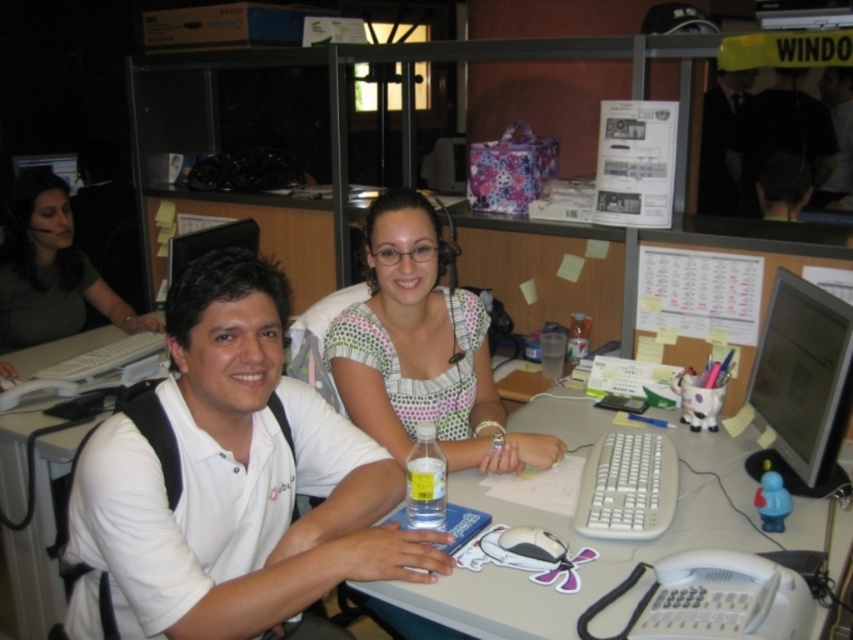
Question: Among these objects, which one is farthest from the camera?

Choices:
 (A) matte green shirt at left
 (B) white plastic table at center
 (C) black matte shirt at upper right

Answer: (C)

Question: Does matte black monitor at right appear on the right side of white plastic table at center?

Choices:
 (A) yes
 (B) no

Answer: (A)

Question: Which point is farther to the camera?

Choices:
 (A) (28, 552)
 (B) (830, 440)
 (C) (268, 294)
 (D) (851, 193)

Answer: (D)

Question: Which object appears closest to the camera in this image?

Choices:
 (A) white matte shirt at center
 (B) white plastic table at center
 (C) matte black monitor at right
 (D) matte green shirt at left

Answer: (A)

Question: From the image, what is the correct spatial relationship of white plastic table at center in relation to black matte shirt at upper right?

Choices:
 (A) above
 (B) below

Answer: (B)

Question: Is matte green shirt at left below black matte shirt at upper right?

Choices:
 (A) no
 (B) yes

Answer: (B)